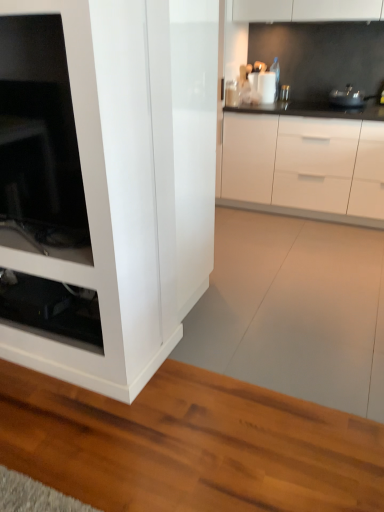
The image size is (384, 512). In order to click on free spot above transparent glass shelf at lower left (from a real-world perspective) in this screenshot , I will do `click(48, 318)`.